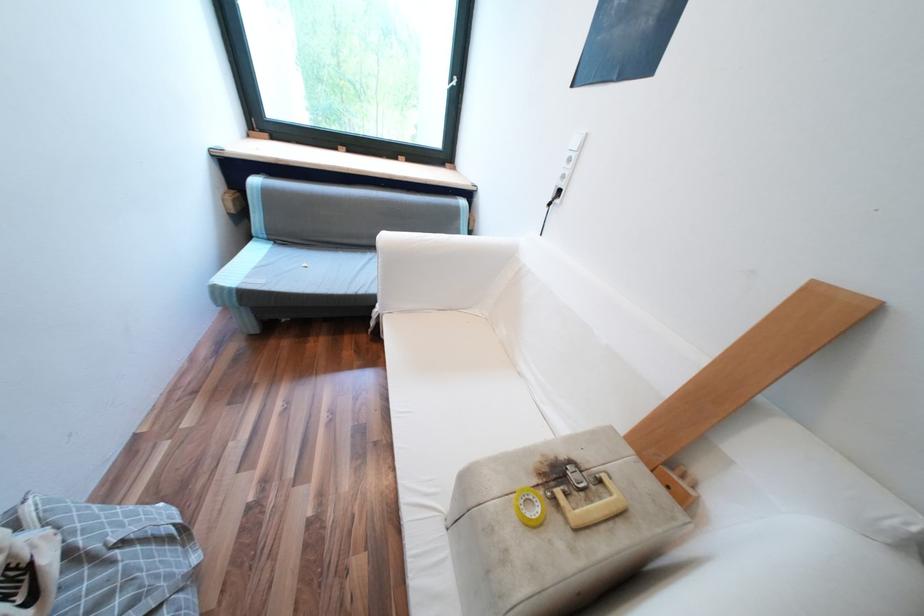
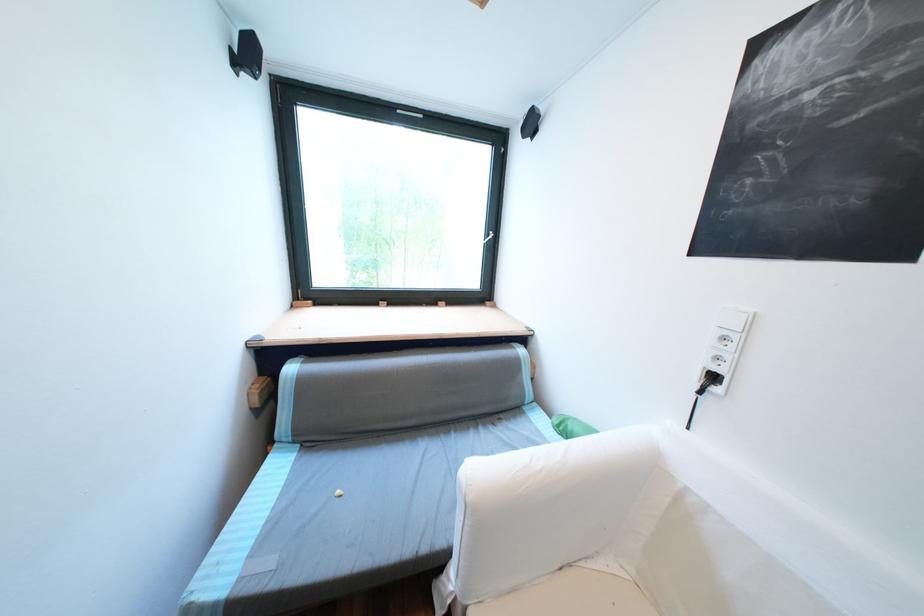
Locate, in the second image, the point that corresponds to point 566,200 in the first image.

(725, 390)